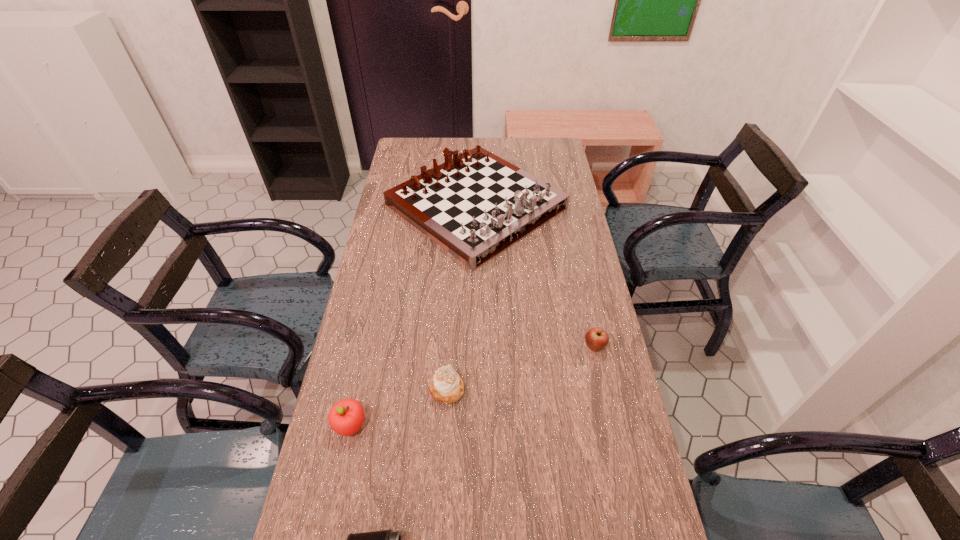
This screenshot has height=540, width=960. Identify the location of the tallest object. (476, 205).

Identify the location of gameboard. This screenshot has width=960, height=540. (476, 205).

Locate an element on the screen. This screenshot has height=540, width=960. the fourth farthest object is located at coordinates (346, 417).

In order to click on the nearer apple in this screenshot , I will do `click(346, 417)`.

Where is `pastry`? This screenshot has width=960, height=540. pastry is located at coordinates (446, 386).

At what (x,y) coordinates should I click in order to perform the action: click on the fourth nearest object. Please return your answer as a coordinate pair (x, y). This screenshot has width=960, height=540. Looking at the image, I should click on click(x=596, y=338).

What are the coordinates of `the farther apple` in the screenshot? It's located at (596, 338).

I want to click on blank space located on the front of the gameboard, so pyautogui.click(x=475, y=323).

Identify the location of free space located on the right of the fourth farthest object. Image resolution: width=960 pixels, height=540 pixels. (511, 425).

This screenshot has height=540, width=960. What are the coordinates of `free space located on the right of the third farthest object` in the screenshot? It's located at (486, 389).